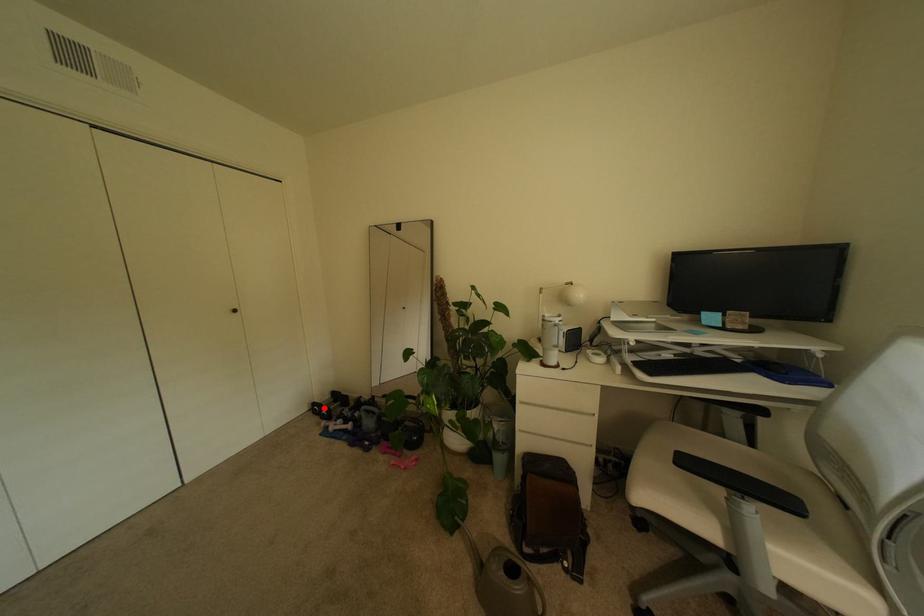
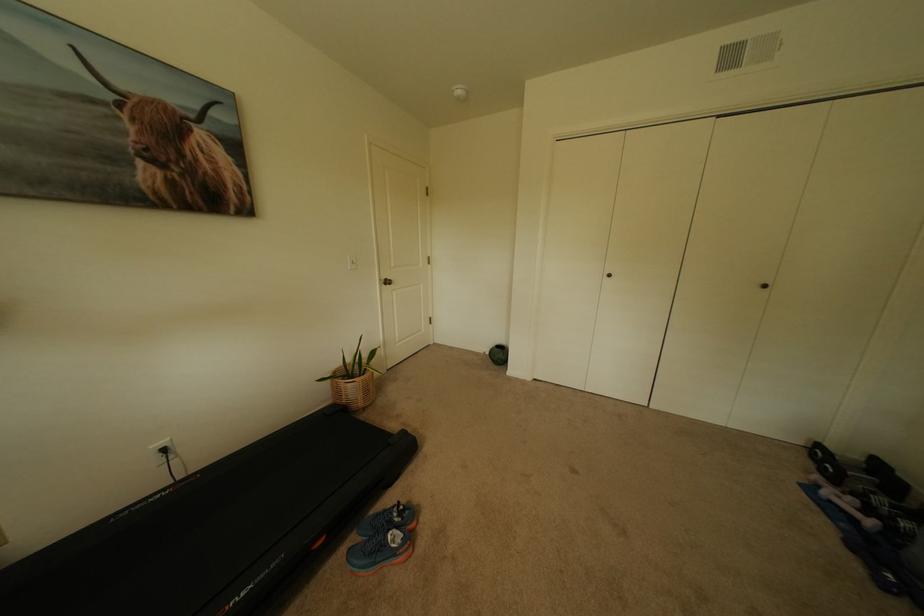
In the second image, find the point that corresponds to the highlighted location in the first image.

(827, 452)